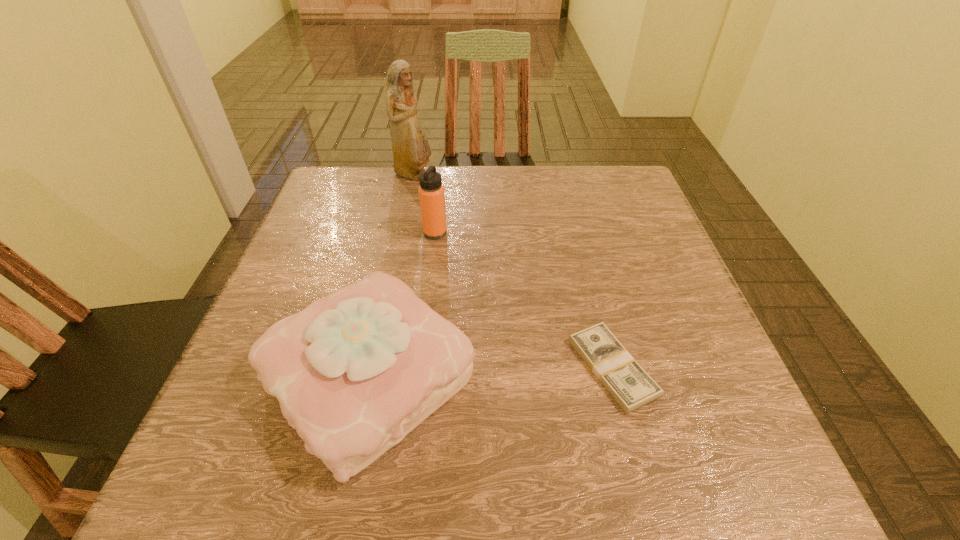
Locate an element on the screen. This screenshot has width=960, height=540. free space at the near left corner of the desktop is located at coordinates (282, 449).

Find the location of a particular element. vacant area at the far right corner is located at coordinates (592, 199).

Locate an element on the screen. This screenshot has height=540, width=960. free space between the tallest object and the third tallest object is located at coordinates (392, 276).

Locate an element on the screen. The height and width of the screenshot is (540, 960). free point between the dollar and the figurine is located at coordinates (513, 272).

This screenshot has width=960, height=540. I want to click on vacant space that is in between the dollar and the third shortest object, so click(x=524, y=300).

Where is `vacant area that lies between the third shortest object and the shortest object`? This screenshot has width=960, height=540. vacant area that lies between the third shortest object and the shortest object is located at coordinates (524, 300).

I want to click on vacant area that lies between the figurine and the second shortest object, so click(x=392, y=276).

The image size is (960, 540). Find the location of `vacant space in between the dollar and the figurine`. vacant space in between the dollar and the figurine is located at coordinates (513, 272).

Identify which object is located as the second nearest to the thermos bottle. Please provide its 2D coordinates. Your answer should be formatted as a tuple, i.e. [(x, y)], where the tuple contains the x and y coordinates of a point satisfying the conditions above.

[(354, 372)]

Find the location of a particular element. The image size is (960, 540). the closest object to the dollar is located at coordinates (354, 372).